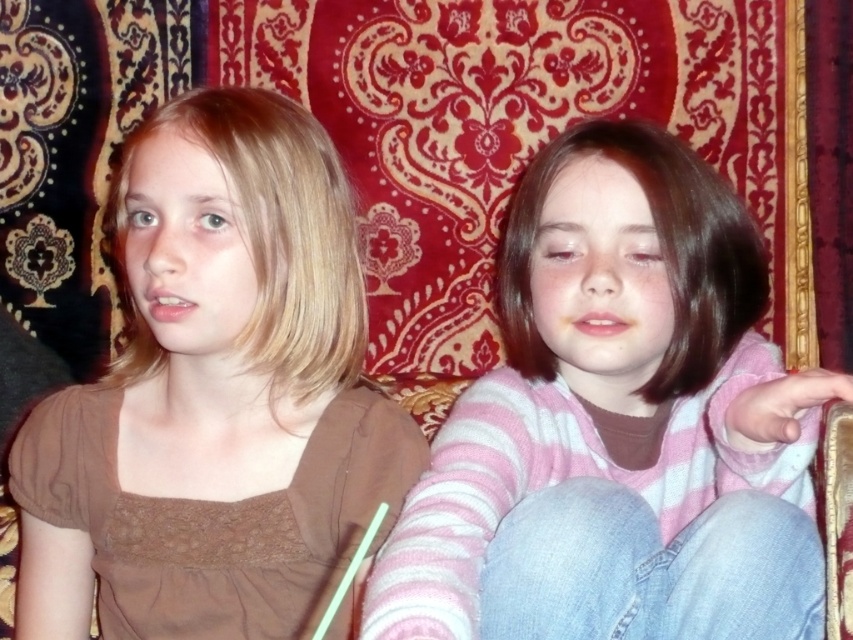
Can you confirm if pink striped sweater at center is thinner than brown matte shirt at left?

No.

Identify the location of pink striped sweater at center. (618, 426).

Where is `pink striped sweater at center`? pink striped sweater at center is located at coordinates (618, 426).

You are a GUI agent. You are given a task and a screenshot of the screen. Output one action in this format:
    pyautogui.click(x=<x>, y=<y>)
    Task: Click on the pink striped sweater at center
    
    Given the screenshot: What is the action you would take?
    pos(618,426)